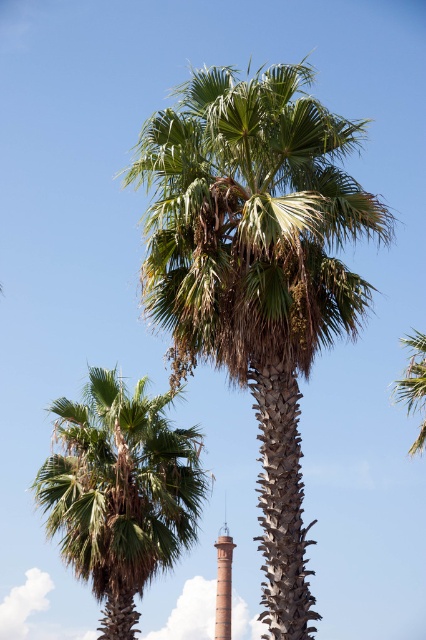
Is green leafy palm at lower left taller than green leafy palm tree at upper right?

Yes, green leafy palm at lower left is taller than green leafy palm tree at upper right.

How distant is green leafy palm at lower left from green leafy palm tree at upper right?

green leafy palm at lower left is 12.64 meters away from green leafy palm tree at upper right.

Between point (60, 502) and point (419, 396), which one is positioned in front?

Positioned in front is point (60, 502).

This screenshot has height=640, width=426. Identify the location of green leafy palm at lower left. (120, 492).

In order to click on green leafy palm tree at center in this screenshot , I will do `click(256, 269)`.

Can you confirm if green leafy palm tree at center is wider than green leafy palm at lower left?

Indeed, green leafy palm tree at center has a greater width compared to green leafy palm at lower left.

Find the location of `green leafy palm tree at center`. green leafy palm tree at center is located at coordinates (256, 269).

Find the location of a particular element. green leafy palm tree at center is located at coordinates (256, 269).

Between green leafy palm tree at center and green leafy palm tree at upper right, which one appears on the left side from the viewer's perspective?

green leafy palm tree at center

Who is more forward, (294,600) or (420,433)?

Point (294,600)

At what (x,y) coordinates should I click in order to perform the action: click on green leafy palm tree at center. Please return your answer as a coordinate pair (x, y). Looking at the image, I should click on (256, 269).